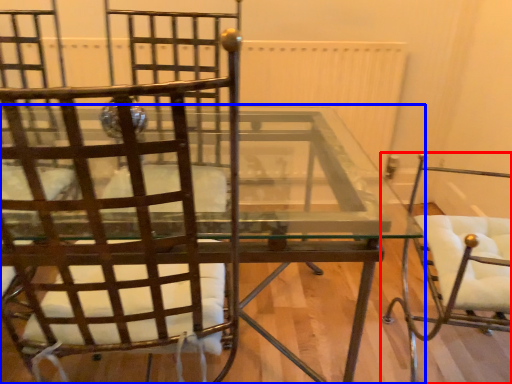
Question: Which of the following is the farthest to the observer, chair (highlighted by a red box) or table (highlighted by a blue box)?

Choices:
 (A) chair
 (B) table

Answer: (B)